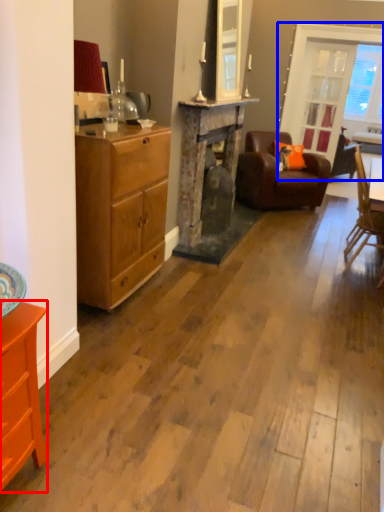
Question: Which point is further to the camera, cabinetry (highlighted by a red box) or window screen (highlighted by a blue box)?

Choices:
 (A) cabinetry
 (B) window screen

Answer: (B)